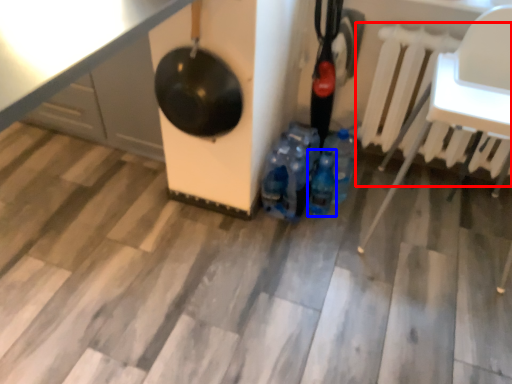
Question: Which of the following is the farthest to the observer, radiator (highlighted by a red box) or bottle (highlighted by a blue box)?

Choices:
 (A) radiator
 (B) bottle

Answer: (B)